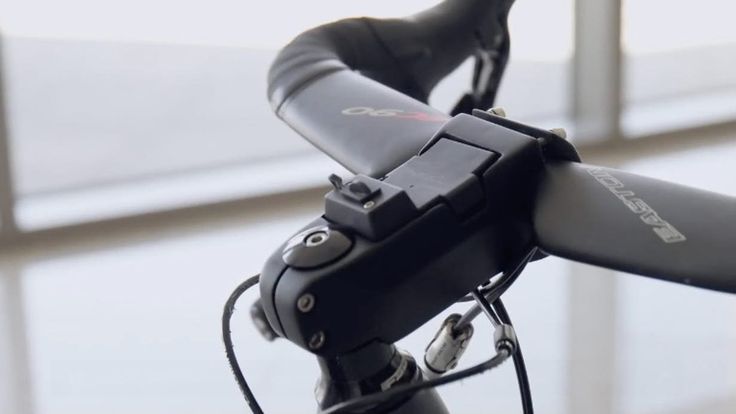
The image size is (736, 414). Identify the location of handle. (308, 64).